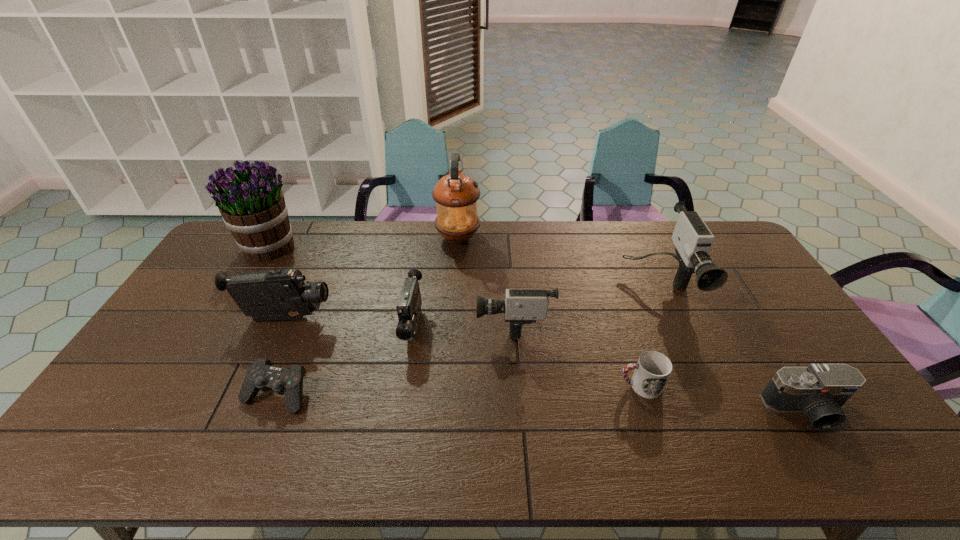
Locate an element on the screen. Image resolution: width=960 pixels, height=540 pixels. the second closest camcorder to the shortest camcorder is located at coordinates (282, 294).

Locate an element on the screen. the third closest camcorder relative to the bouquet is located at coordinates (521, 306).